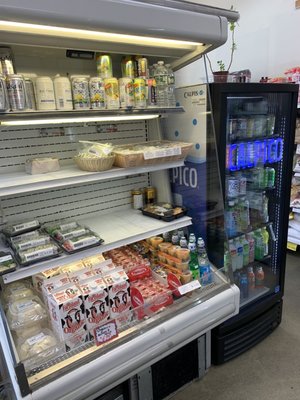
Where is `light gray floor`? light gray floor is located at coordinates (269, 377).